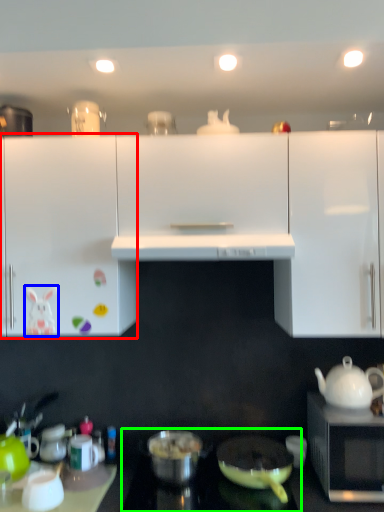
Question: Which is farther away from cabinetry (highlighted by a red box)? animal (highlighted by a blue box) or gas stove (highlighted by a green box)?

Choices:
 (A) animal
 (B) gas stove

Answer: (B)